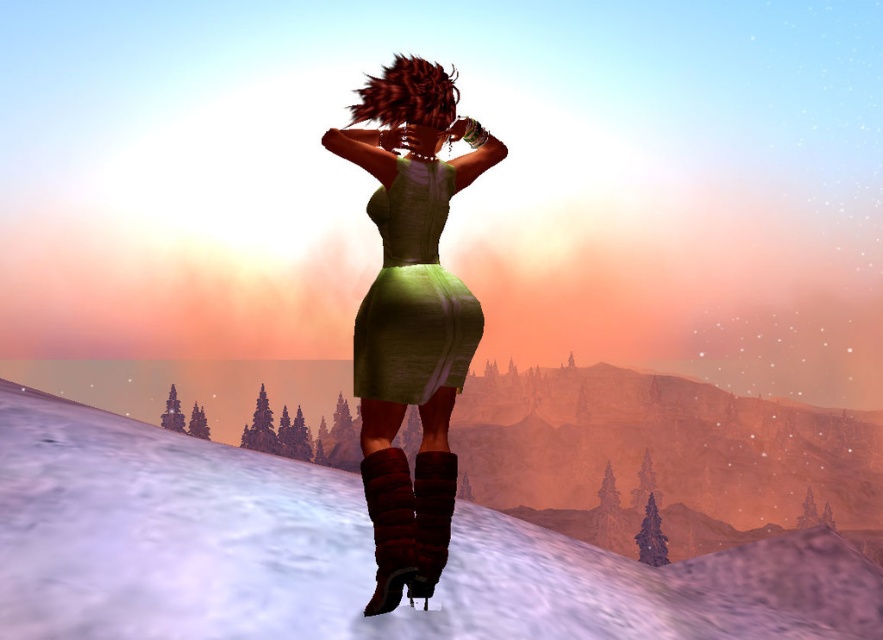
Question: Is white fluffy snow at lower center thinner than green fabric dress at center?

Choices:
 (A) yes
 (B) no

Answer: (B)

Question: Can you confirm if green textured dress at center is positioned to the left of knitted brown boot at lower center?

Choices:
 (A) yes
 (B) no

Answer: (B)

Question: Which of the following is the farthest from the observer?

Choices:
 (A) [383, 589]
 (B) [402, 204]
 (C) [396, 545]

Answer: (B)

Question: Among these points, which one is nearest to the camera?

Choices:
 (A) (442, 481)
 (B) (398, 531)

Answer: (B)

Question: Estimate the real-world distances between objects in this image. Which object is farther from the leather-like brown boot at lower center?

Choices:
 (A) white fluffy snow at lower center
 (B) knitted brown boot at lower center
 (C) green textured dress at center
 (D) green fabric dress at center

Answer: (A)

Question: Does green fabric dress at center have a smaller size compared to knitted brown boot at lower center?

Choices:
 (A) yes
 (B) no

Answer: (B)